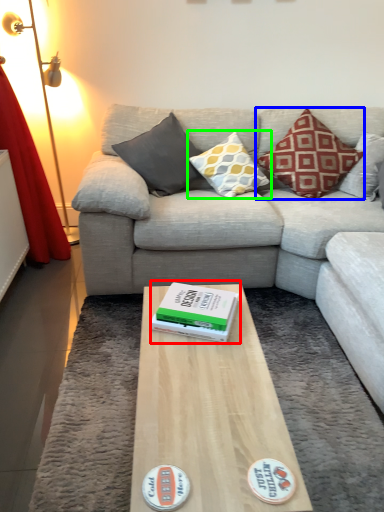
Question: Estimate the real-world distances between objects in this image. Which object is farther from paperback book (highlighted by a red box), pillow (highlighted by a blue box) or pillow (highlighted by a green box)?

Choices:
 (A) pillow
 (B) pillow

Answer: (A)